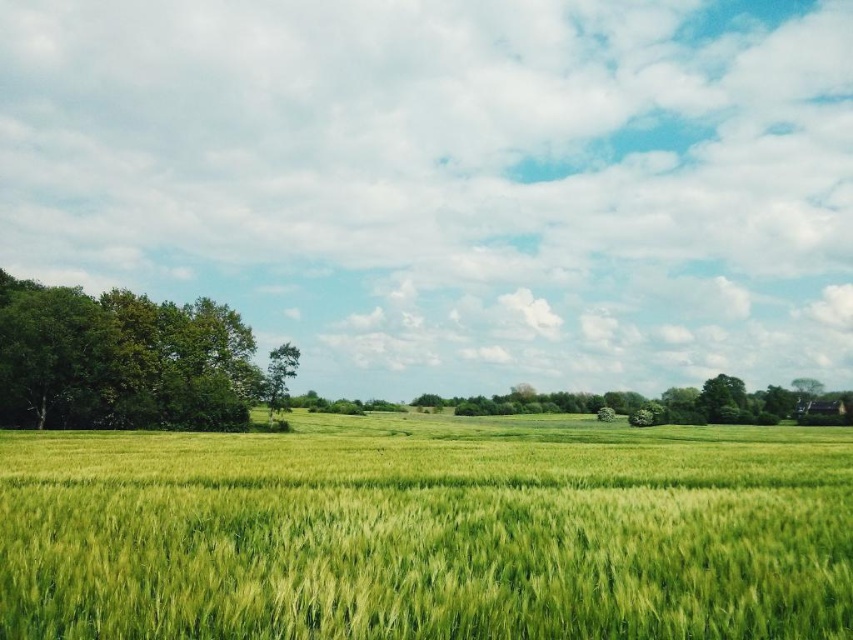
Question: Based on their relative distances, which object is farther from the green leafy tree at left?

Choices:
 (A) green grassy wheat field at center
 (B) green leafy tree at center-left

Answer: (A)

Question: Among these points, which one is nearest to the camera?

Choices:
 (A) (35, 356)
 (B) (553, 536)
 (C) (283, 394)

Answer: (B)

Question: Does green grassy wheat field at center lie in front of green leafy tree at center-left?

Choices:
 (A) no
 (B) yes

Answer: (B)

Question: In this image, where is green leafy tree at left located relative to green leafy tree at center-left?

Choices:
 (A) above
 (B) below

Answer: (A)

Question: Can you confirm if green grassy wheat field at center is positioned to the left of green leafy tree at left?

Choices:
 (A) yes
 (B) no

Answer: (B)

Question: Which object appears farthest from the camera in this image?

Choices:
 (A) green grassy wheat field at center
 (B) green leafy tree at left
 (C) green leafy tree at center-left

Answer: (C)